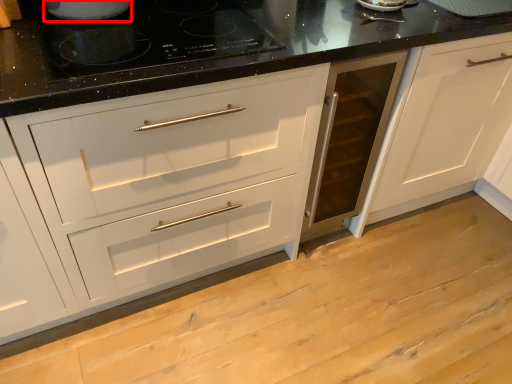
Question: In this image, where is appliance (annotated by the red box) located relative to gas stove?

Choices:
 (A) right
 (B) left

Answer: (B)